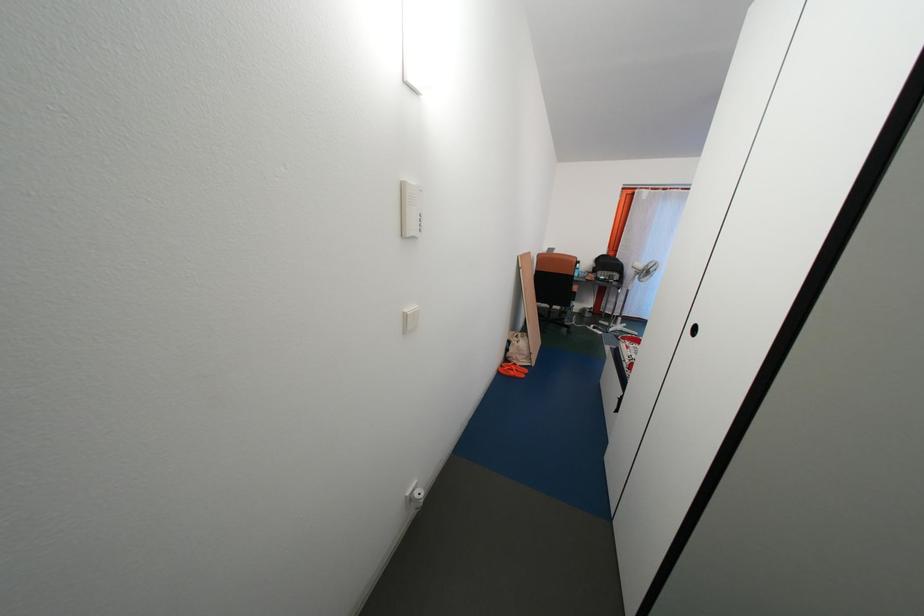
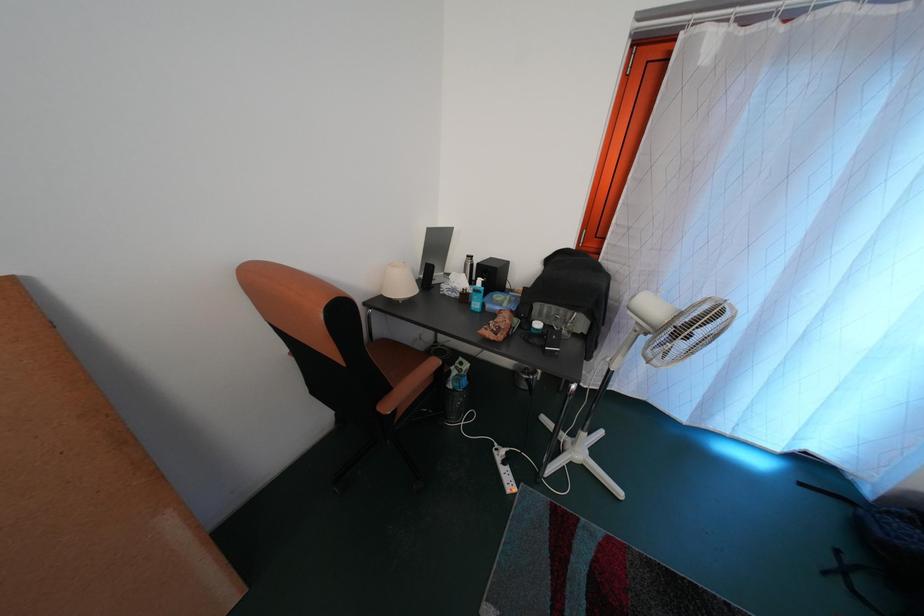
The images are taken continuously from a first-person perspective. In which direction are you moving?

The cameraman walked toward right, forward.